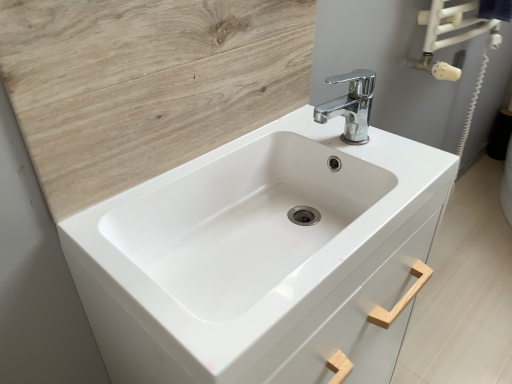
At what (x,y) coordinates should I click in order to perform the action: click on vacant space to the right of chrome metallic faucet at upper center. Please return your answer as a coordinate pair (x, y). The image size is (512, 384). Looking at the image, I should click on (401, 151).